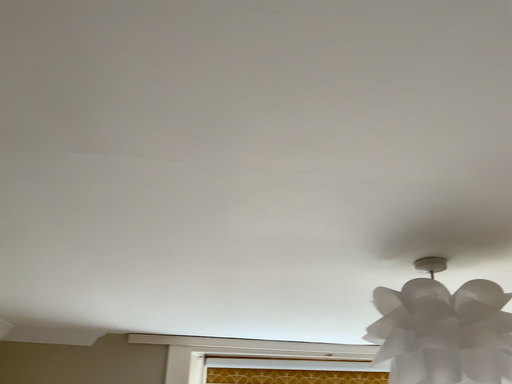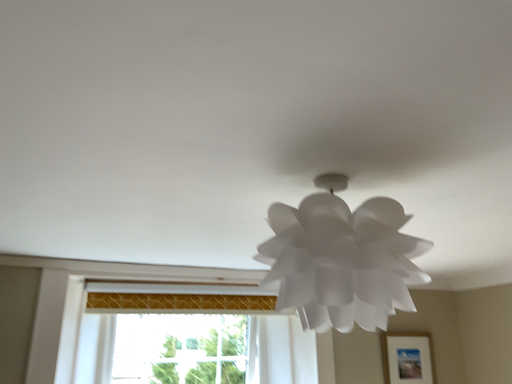
Question: Which way did the camera rotate in the video?

Choices:
 (A) rotated left
 (B) rotated right

Answer: (B)